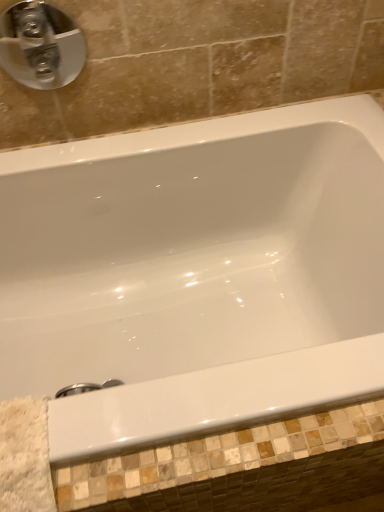
In order to click on white glossy bathtub at center in this screenshot , I will do click(196, 274).

The width and height of the screenshot is (384, 512). What do you see at coordinates (196, 274) in the screenshot?
I see `white glossy bathtub at center` at bounding box center [196, 274].

Identify the location of satin nickel faucet at upper left. point(40,45).

Describe the element at coordinates (40, 45) in the screenshot. I see `satin nickel faucet at upper left` at that location.

The image size is (384, 512). Find the location of `white glossy bathtub at center`. white glossy bathtub at center is located at coordinates (196, 274).

Considering the positions of objects satin nickel faucet at upper left and white glossy bathtub at center in the image provided, who is more to the right, satin nickel faucet at upper left or white glossy bathtub at center?

white glossy bathtub at center.

Is the position of satin nickel faucet at upper left less distant than that of white glossy bathtub at center?

No, satin nickel faucet at upper left is further to the viewer.

Is point (19, 42) closer to viewer compared to point (161, 160)?

That is True.

From the image's perspective, is satin nickel faucet at upper left below white glossy bathtub at center?

Actually, satin nickel faucet at upper left appears above white glossy bathtub at center in the image.

From a real-world perspective, does satin nickel faucet at upper left stand above white glossy bathtub at center?

Yes, from a real-world perspective, satin nickel faucet at upper left is above white glossy bathtub at center.

Considering the sizes of objects satin nickel faucet at upper left and white glossy bathtub at center in the image provided, who is wider, satin nickel faucet at upper left or white glossy bathtub at center?

With larger width is white glossy bathtub at center.

Is satin nickel faucet at upper left taller than white glossy bathtub at center?

Correct, satin nickel faucet at upper left is much taller as white glossy bathtub at center.

Considering the sizes of objects satin nickel faucet at upper left and white glossy bathtub at center in the image provided, who is smaller, satin nickel faucet at upper left or white glossy bathtub at center?

Smaller between the two is satin nickel faucet at upper left.

Is satin nickel faucet at upper left inside or outside of white glossy bathtub at center?

satin nickel faucet at upper left exists outside the volume of white glossy bathtub at center.

Is there a large distance between satin nickel faucet at upper left and white glossy bathtub at center?

They are positioned close to each other.

Is satin nickel faucet at upper left aimed at white glossy bathtub at center?

No, satin nickel faucet at upper left is not aimed at white glossy bathtub at center.

At what (x,y) coordinates should I click in order to perform the action: click on bathtub in front of the satin nickel faucet at upper left. Please return your answer as a coordinate pair (x, y). This screenshot has height=512, width=384. Looking at the image, I should click on (196, 274).

Can you confirm if white glossy bathtub at center is positioned to the left of satin nickel faucet at upper left?

Incorrect, white glossy bathtub at center is not on the left side of satin nickel faucet at upper left.

Is white glossy bathtub at center further to camera compared to satin nickel faucet at upper left?

No, white glossy bathtub at center is closer to the camera.

Considering the points (7, 329) and (35, 42), which point is in front, point (7, 329) or point (35, 42)?

The point (35, 42) is closer.

From the image's perspective, which is above, white glossy bathtub at center or satin nickel faucet at upper left?

satin nickel faucet at upper left appears higher in the image.

From a real-world perspective, is white glossy bathtub at center located higher than satin nickel faucet at upper left?

Actually, white glossy bathtub at center is physically below satin nickel faucet at upper left in the real world.

Is white glossy bathtub at center wider or thinner than satin nickel faucet at upper left?

In the image, white glossy bathtub at center appears to be wider than satin nickel faucet at upper left.

Who is shorter, white glossy bathtub at center or satin nickel faucet at upper left?

With less height is white glossy bathtub at center.

Which of these two, white glossy bathtub at center or satin nickel faucet at upper left, is bigger?

white glossy bathtub at center.

Is white glossy bathtub at center situated inside satin nickel faucet at upper left or outside?

The correct answer is: outside.

Is white glossy bathtub at center far away from satin nickel faucet at upper left?

No, white glossy bathtub at center is not far away from satin nickel faucet at upper left.

Is white glossy bathtub at center facing away from satin nickel faucet at upper left?

white glossy bathtub at center is not turned away from satin nickel faucet at upper left.

Measure the distance from white glossy bathtub at center to satin nickel faucet at upper left.

The distance of white glossy bathtub at center from satin nickel faucet at upper left is 20.32 inches.

Image resolution: width=384 pixels, height=512 pixels. What are the coordinates of `tap on the left of white glossy bathtub at center` in the screenshot? It's located at (40, 45).

This screenshot has height=512, width=384. Find the location of `tap that is above the white glossy bathtub at center (from the image's perspective)`. tap that is above the white glossy bathtub at center (from the image's perspective) is located at coordinates (40, 45).

What are the coordinates of `tap on the left of white glossy bathtub at center` in the screenshot? It's located at (40, 45).